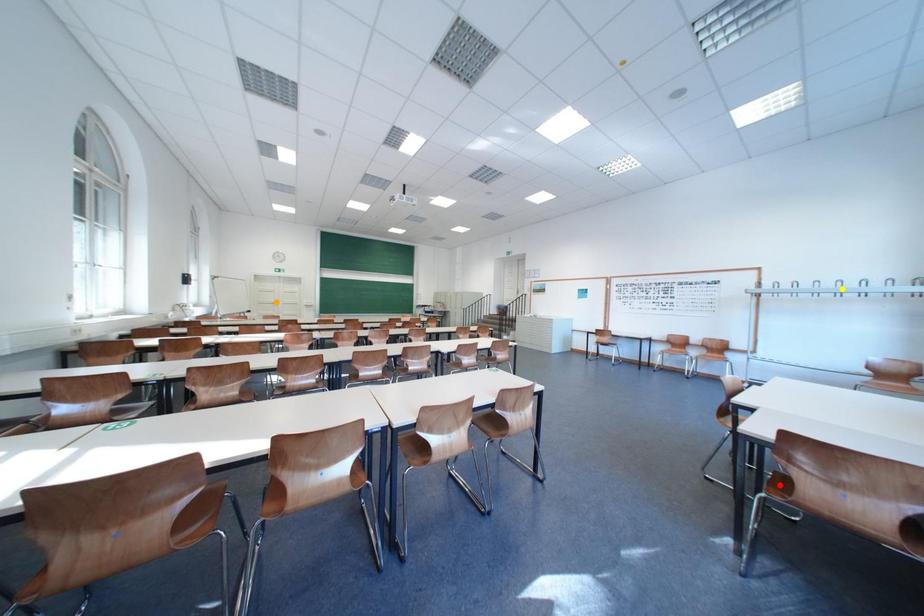
Order these from nearest to farthest:
1. orange point
2. yellow point
3. red point

orange point → yellow point → red point